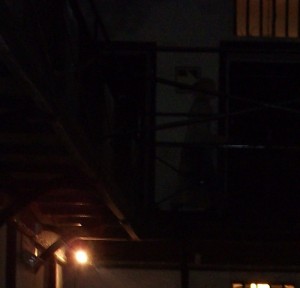
I want to click on joist, so click(x=79, y=231), click(x=37, y=192), click(x=183, y=275).